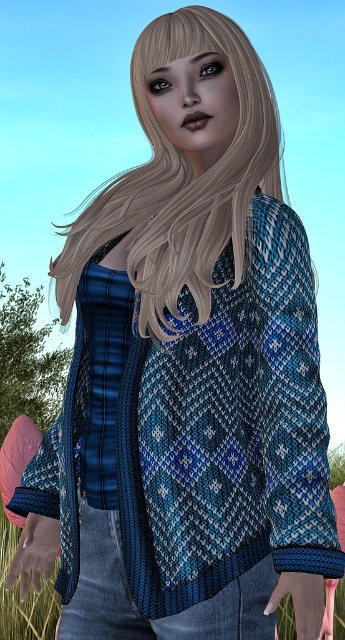
You are a photographer trying to capture the perfect shot of the person with blondehair at center and the green grass at lower left. To ensure both are in frame, should you adjust your camera to the left or right?

The blondehair at center is to the right of the green grass at lower left, so you should adjust your camera to the left to include both in the frame.

You are a photographer setting up a tripod to capture a person wearing denim at center and green grass at lower left. The tripod requires a minimum of 8 feet between the denim and green grass to ensure stability. Can the tripod be safely positioned in this scene?

The distance between denim at center and green grass at lower left is 8.33 feet, which exceeds the tripod requirement of 8 feet. Therefore, the tripod can be safely positioned in this scene.

You are standing at the origin point in the image and want to walk towards the point labeled as point (120, 531). Will you pass by the point labeled as point (257, 120) before reaching your destination?

Since point (257, 120) is behind point (120, 531), you will not pass by point (257, 120) before reaching point (120, 531).